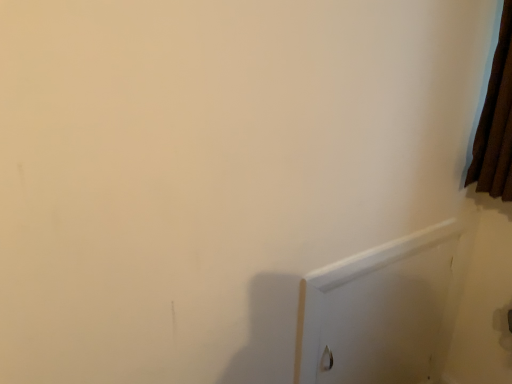
Locate an element on the screen. This screenshot has height=384, width=512. white glossy screen door at lower right is located at coordinates (379, 311).

Image resolution: width=512 pixels, height=384 pixels. What do you see at coordinates (379, 311) in the screenshot?
I see `white glossy screen door at lower right` at bounding box center [379, 311].

Image resolution: width=512 pixels, height=384 pixels. I want to click on white glossy screen door at lower right, so click(379, 311).